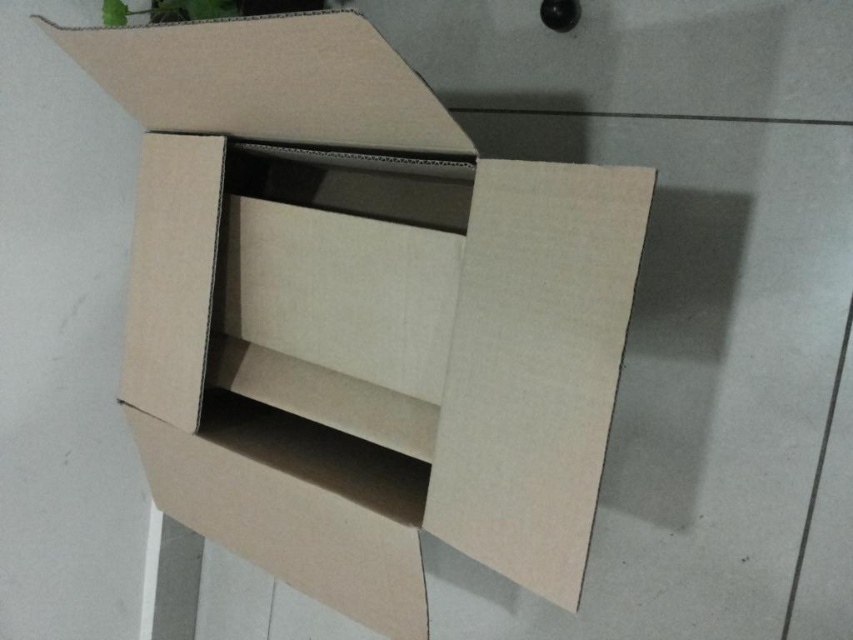
You are standing in front of an open cardboard box on a tiled floor. You notice two points marked on the box. The first point is at coordinates point [318,499] and the second is at point [115,10]. Which of these two points is closer to you?

Point [318,499] is closer to the camera than point [115,10], so the first point is closer to you.

You are moving a green leafy plant at upper left into a new room. The brown cardboard box at center is in the way. Can you move the plant past the box without bending or lifting it?

The brown cardboard box at center is 18.32 inches from the green leafy plant at upper left. Since the distance between them is sufficient, you can move the plant past the box without needing to bend or lift it.